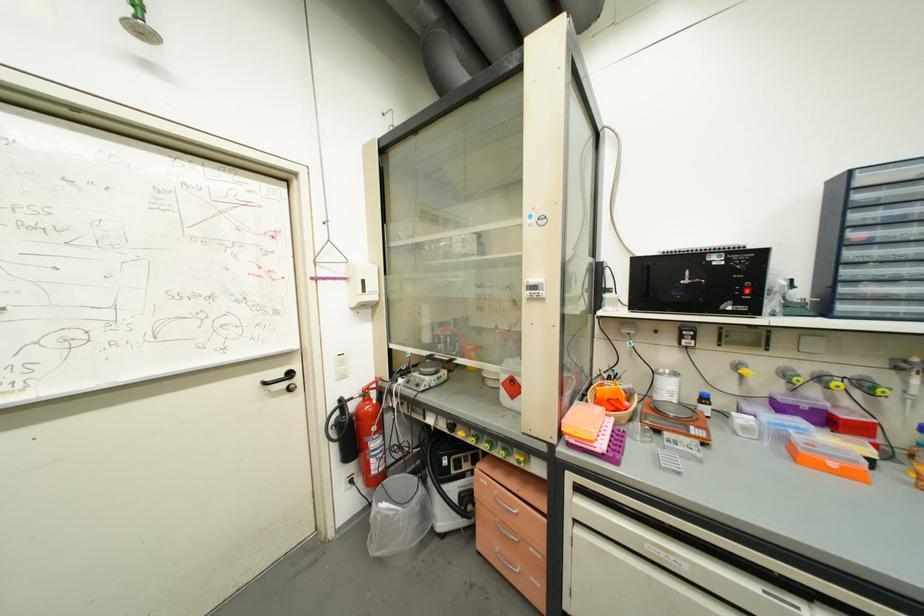
Find where to lift the fire extinguisher handle. Please return your answer as a coordinate pair (x, y).

(370, 437)